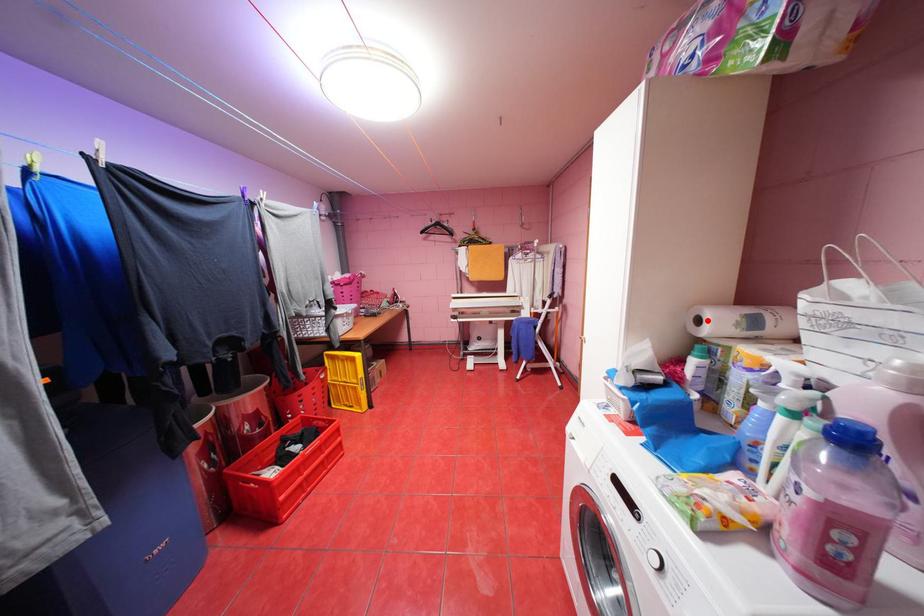
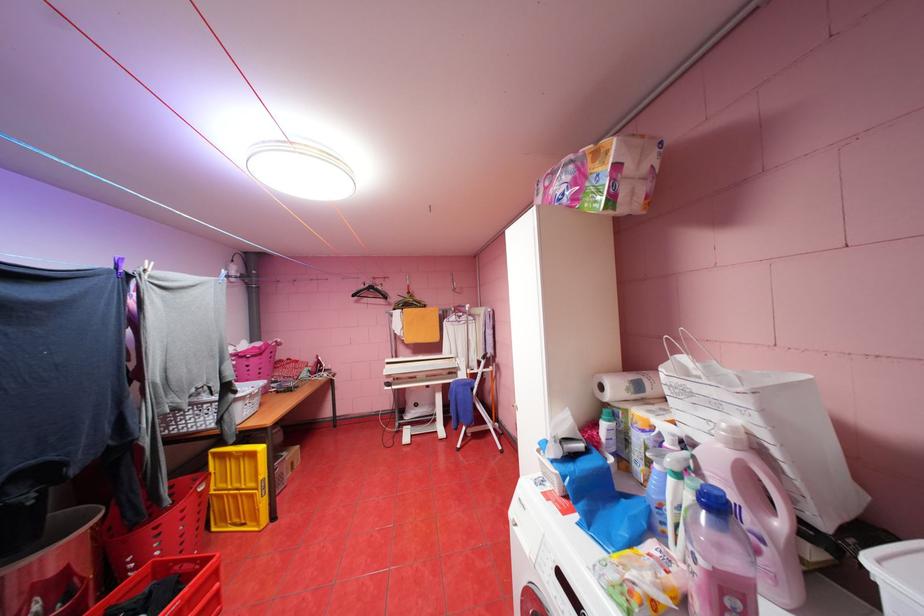
In the second image, find the point that corresponds to the highlighted location in the first image.

(610, 387)